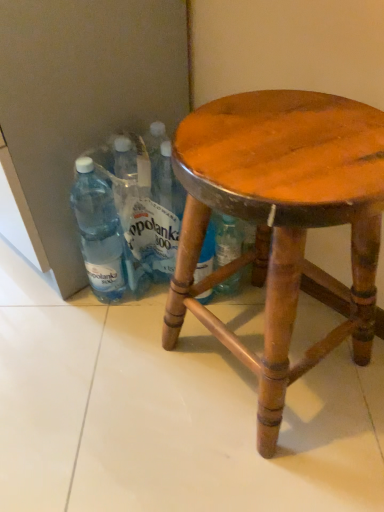
Question: Considering the positions of transparent plastic bottle at left and wooden stool at center in the image, is transparent plastic bottle at left taller or shorter than wooden stool at center?

Choices:
 (A) short
 (B) tall

Answer: (A)

Question: Do you think transparent plastic bottle at left is within wooden stool at center, or outside of it?

Choices:
 (A) inside
 (B) outside

Answer: (B)

Question: Which of these objects is positioned farthest from the wooden stool at center?

Choices:
 (A) transparent plastic bottle at left
 (B) transparent plastic bottles at lower left

Answer: (A)

Question: Which object is the farthest from the wooden stool at center?

Choices:
 (A) transparent plastic bottle at left
 (B) transparent plastic bottles at lower left

Answer: (A)